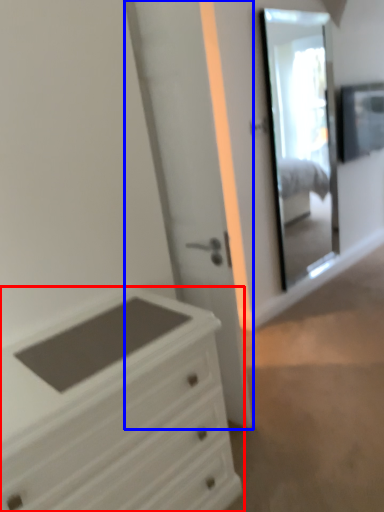
Question: Among these objects, which one is farthest to the camera, chest of drawers (highlighted by a red box) or door (highlighted by a blue box)?

Choices:
 (A) chest of drawers
 (B) door

Answer: (B)